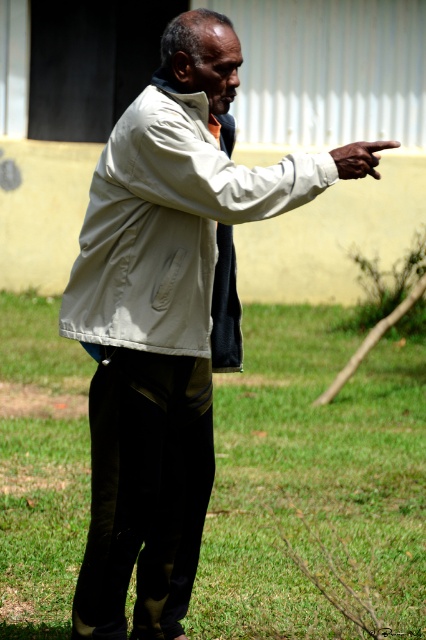
You are a photographer trying to capture the man pointing towards the off camera area. Based on the scene, where should you position yourself so that the white matte hand at upper right is above the green grass at center in the photo?

Position yourself so that the white matte hand at upper right is above the green grass at center, as the green grass at center is positioned under white matte hand at upper right.

You are a photographer trying to frame a shot of the light beige fabric jacket at center. What are the exact coordinates where you should focus your camera?

The exact coordinates to focus on are point (172, 230).

You are a fashion designer observing the man in the scene. You need to determine if the light beige fabric jacket at center can be seen from above the green grass at center. Based on their heights, can you confirm this?

The green grass at center is shorter than the light beige fabric jacket at center, so yes, the light beige fabric jacket at center can be seen from above the green grass at center because it is taller.